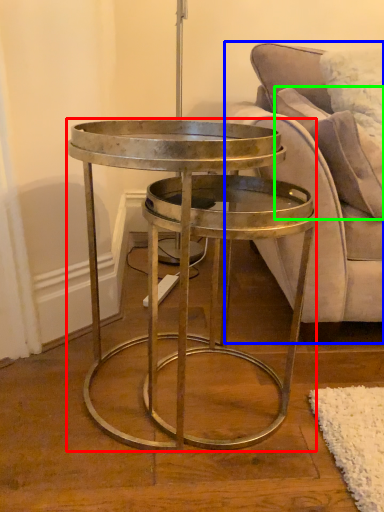
Question: Based on their relative distances, which object is farther from coffee table (highlighted by a red box)? Choose from studio couch (highlighted by a blue box) and pillow (highlighted by a green box).

Choices:
 (A) studio couch
 (B) pillow

Answer: (B)